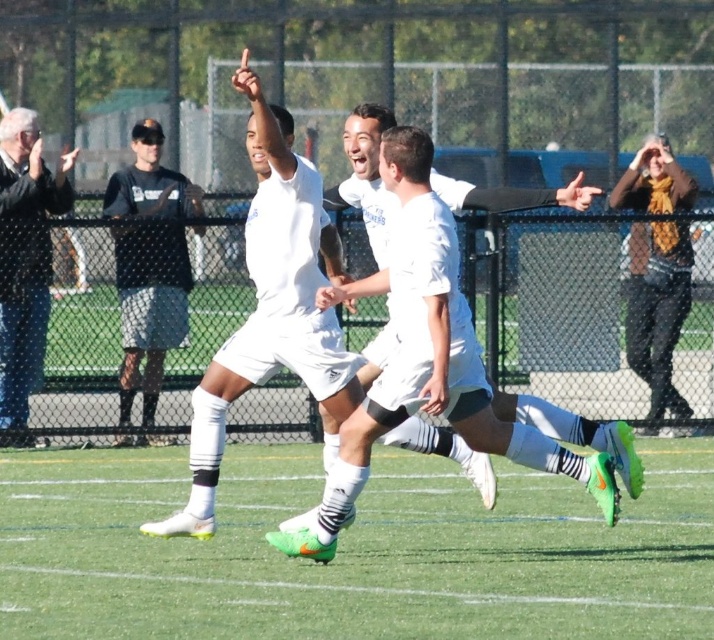
Question: Is white matte soccer player at center wider than blue jeans at left?

Choices:
 (A) yes
 (B) no

Answer: (A)

Question: Which object is the closest to the brown leather jacket at upper right?

Choices:
 (A) black mesh shirt at left
 (B) white matte soccer player at center

Answer: (A)

Question: Which point is farther from the camera taking this photo?

Choices:
 (A) click(x=321, y=342)
 (B) click(x=30, y=252)
 (C) click(x=668, y=196)

Answer: (C)

Question: Can you confirm if white matte soccer player at center is positioned below blue jeans at left?

Choices:
 (A) no
 (B) yes

Answer: (B)

Question: Among these points, which one is farthest from the camera?

Choices:
 (A) (436, 442)
 (B) (171, 294)
 (C) (50, 180)
 (D) (668, 170)

Answer: (D)

Question: Observing the image, what is the correct spatial positioning of white matte soccer player at center in reference to black mesh shirt at left?

Choices:
 (A) below
 (B) above

Answer: (B)